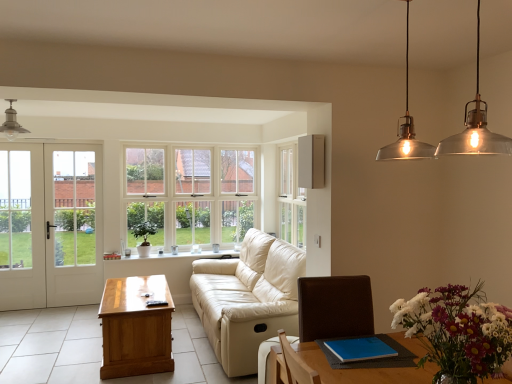
This screenshot has width=512, height=384. In order to click on vacant space situated above white wooden door at left (from a real-world perspective) in this screenshot , I will do `click(30, 140)`.